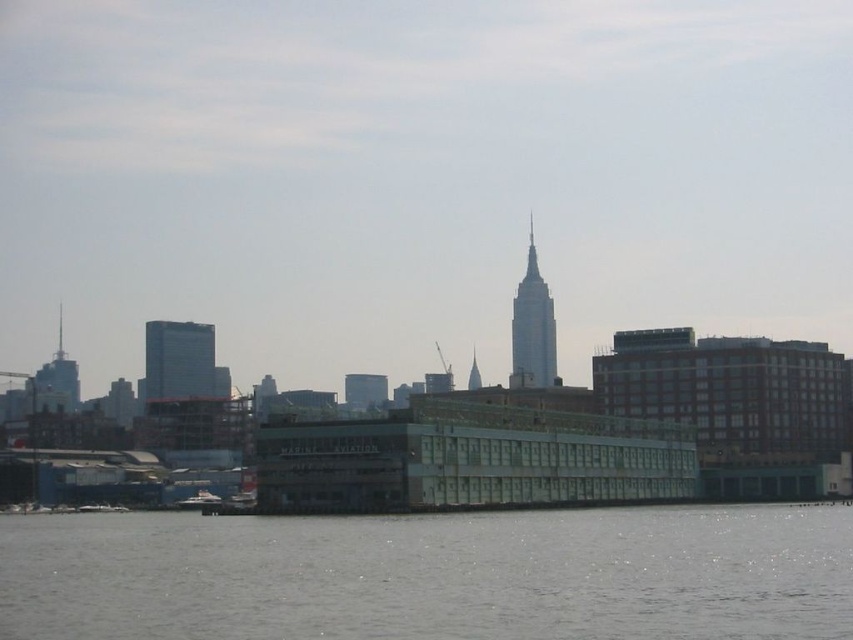
Question: Based on their relative distances, which object is farther from the gray water at lower center?

Choices:
 (A) glassy reflective skyscraper at left
 (B) silver glass skyscraper at center
 (C) white glossy boat at lower left

Answer: (A)

Question: Does glassy reflective skyscraper at left have a lesser width compared to silver glass skyscraper at center?

Choices:
 (A) no
 (B) yes

Answer: (A)

Question: Among these points, which one is farthest from the camera?

Choices:
 (A) (306, 560)
 (B) (541, 289)
 (C) (190, 499)

Answer: (B)

Question: Is gray water at lower center positioned behind glassy reflective skyscraper at left?

Choices:
 (A) yes
 (B) no

Answer: (B)

Question: Considering the relative positions of glassy reflective skyscraper at left and silver glass skyscraper at center in the image provided, where is glassy reflective skyscraper at left located with respect to silver glass skyscraper at center?

Choices:
 (A) left
 (B) right

Answer: (A)

Question: Estimate the real-world distances between objects in this image. Which object is closer to the silver glass skyscraper at center?

Choices:
 (A) gray water at lower center
 (B) white glossy boat at lower left

Answer: (A)